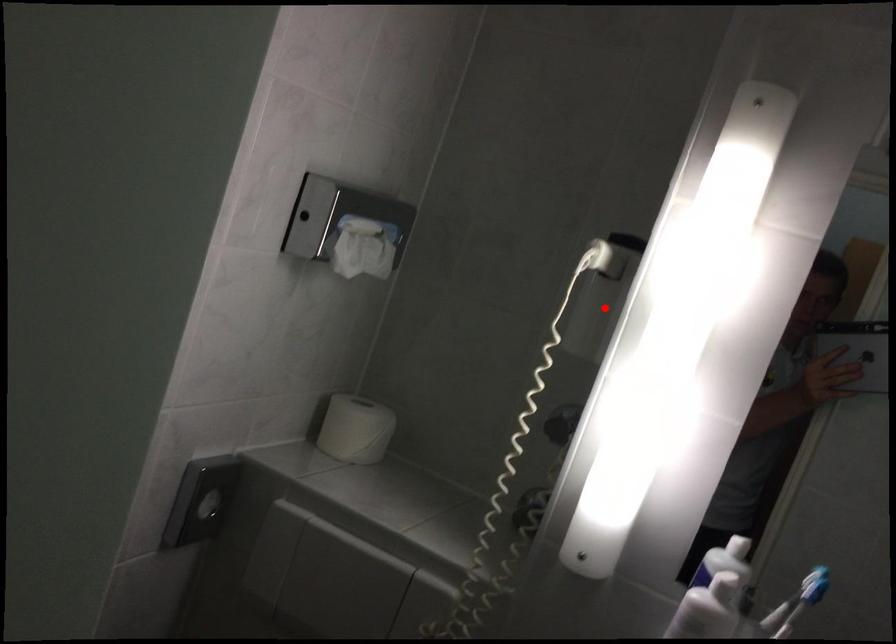
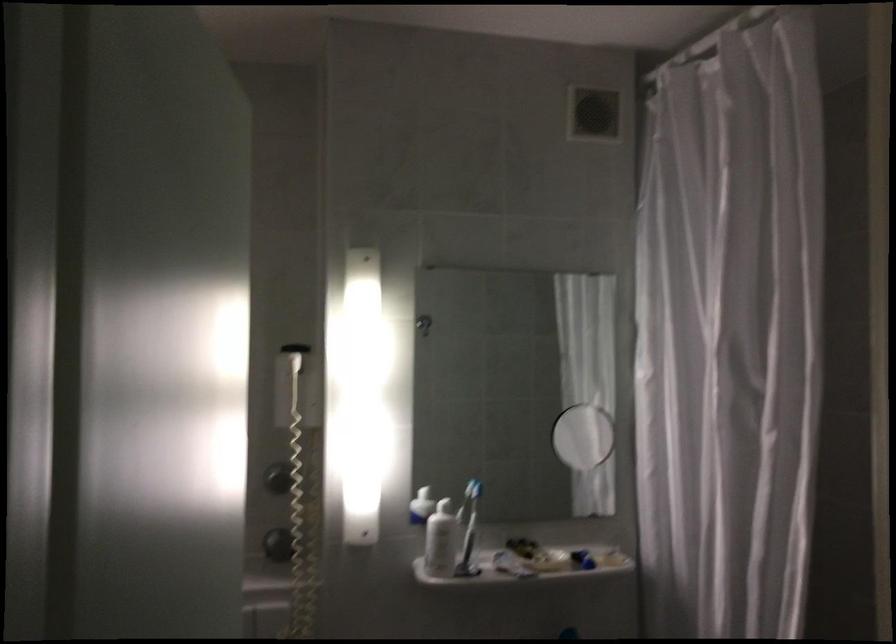
Where in the second image is the point corresponding to the highlighted location from the first image?

(295, 386)